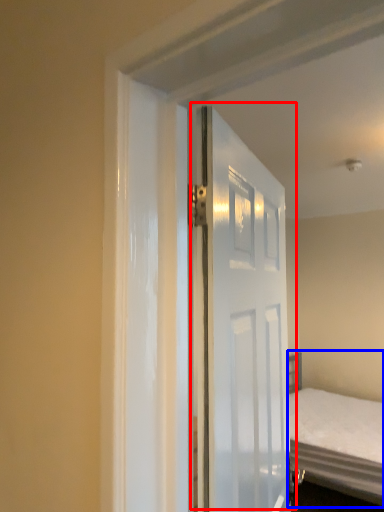
Question: Which object is closer to the camera taking this photo, door (highlighted by a red box) or bed (highlighted by a blue box)?

Choices:
 (A) door
 (B) bed

Answer: (A)